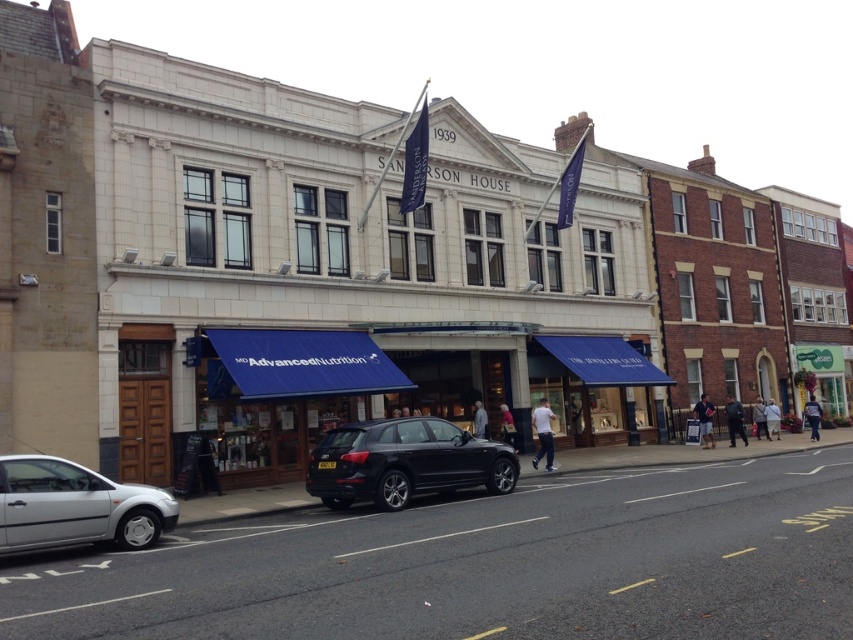
Question: Is light brown leather jacket at center to the left of pink fabric bag at center from the viewer's perspective?

Choices:
 (A) yes
 (B) no

Answer: (B)

Question: Which point is farther to the camera?

Choices:
 (A) black metallic car at center
 (B) white cotton shirt at center

Answer: (B)

Question: Which point is closer to the camera taking this photo?

Choices:
 (A) (810, 408)
 (B) (775, 404)
 (C) (541, 410)
 (D) (404, 504)

Answer: (D)

Question: Does black metallic car at center have a lesser width compared to denim jacket at center?

Choices:
 (A) no
 (B) yes

Answer: (A)

Question: Which object appears closest to the camera in this image?

Choices:
 (A) light brown leather jacket at center
 (B) black metallic car at center

Answer: (B)

Question: Is dark blue jacket at center positioned before light brown leather jacket at center?

Choices:
 (A) yes
 (B) no

Answer: (A)